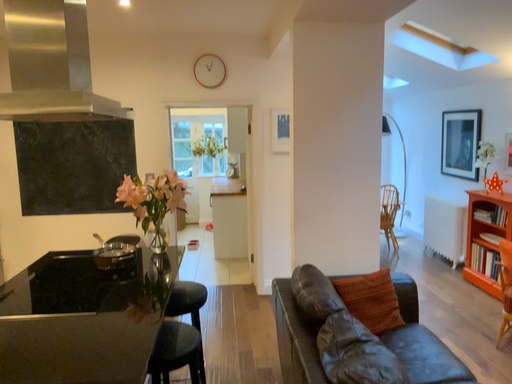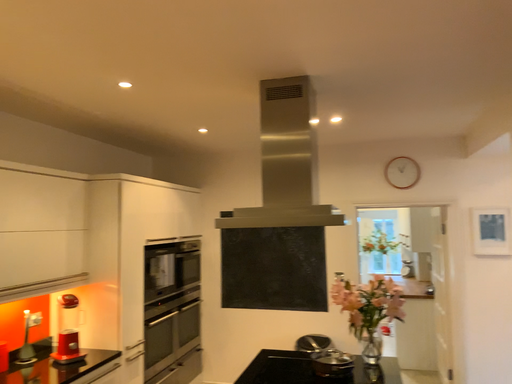
Question: Which way did the camera rotate in the video?

Choices:
 (A) rotated upward
 (B) rotated downward

Answer: (A)